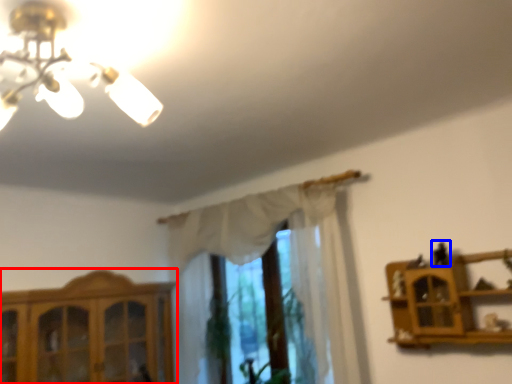
Question: Which object appears farthest to the camera in this image, cabinetry (highlighted by a red box) or toy (highlighted by a blue box)?

Choices:
 (A) cabinetry
 (B) toy

Answer: (A)